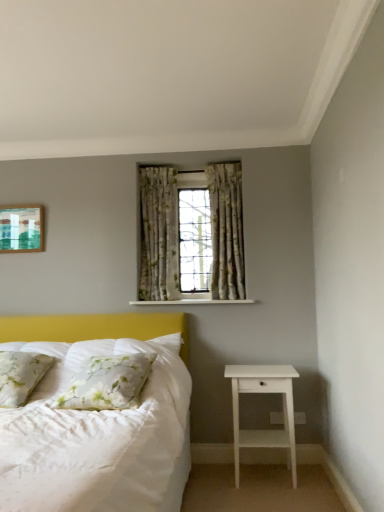
Question: Considering the relative positions of floral fabric curtain at center, the first curtain in the right-to-left sequence, and matte green painting at upper left in the image provided, is floral fabric curtain at center, the first curtain in the right-to-left sequence, to the left or to the right of matte green painting at upper left?

Choices:
 (A) left
 (B) right

Answer: (B)

Question: In the image, is floral fabric curtain at center, the first curtain in the right-to-left sequence, positioned in front of or behind matte green painting at upper left?

Choices:
 (A) front
 (B) behind

Answer: (A)

Question: Which is nearer to the matte green painting at upper left?

Choices:
 (A) floral fabric curtain at center, which is the second curtain in left-to-right order
 (B) green floral fabric curtain at center, the 2th curtain positioned from the right
 (C) floral fabric curtains at center
 (D) white painted wood at center
 (E) floral fabric pillow at left, the second pillow when ordered from right to left

Answer: (B)

Question: Which object is the farthest from the floral fabric curtains at center?

Choices:
 (A) white floral pillow at lower left, acting as the 1th pillow starting from the right
 (B) matte green painting at upper left
 (C) floral fabric pillow at left, the second pillow when ordered from right to left
 (D) white matte nightstand at lower right
 (E) green floral fabric curtain at center, the 2th curtain positioned from the right

Answer: (C)